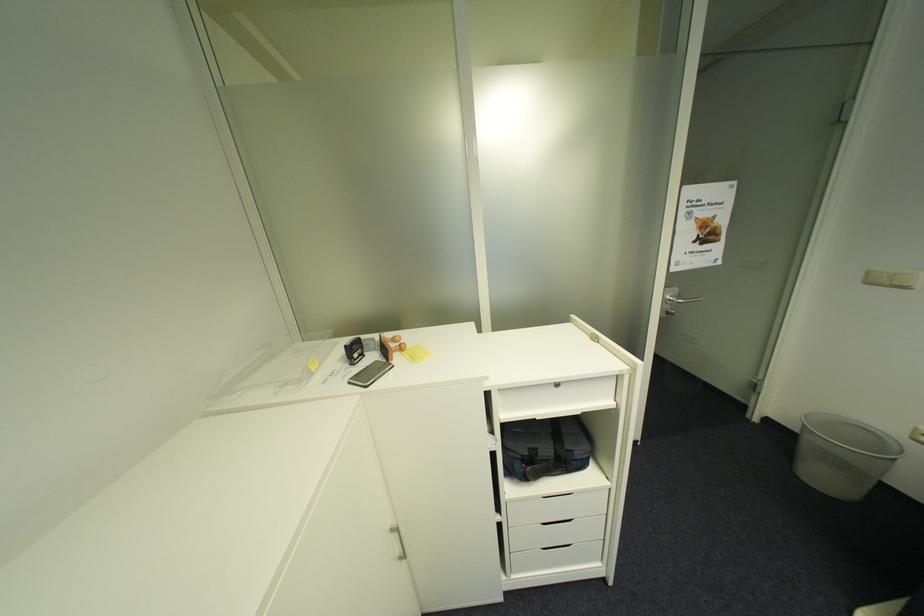
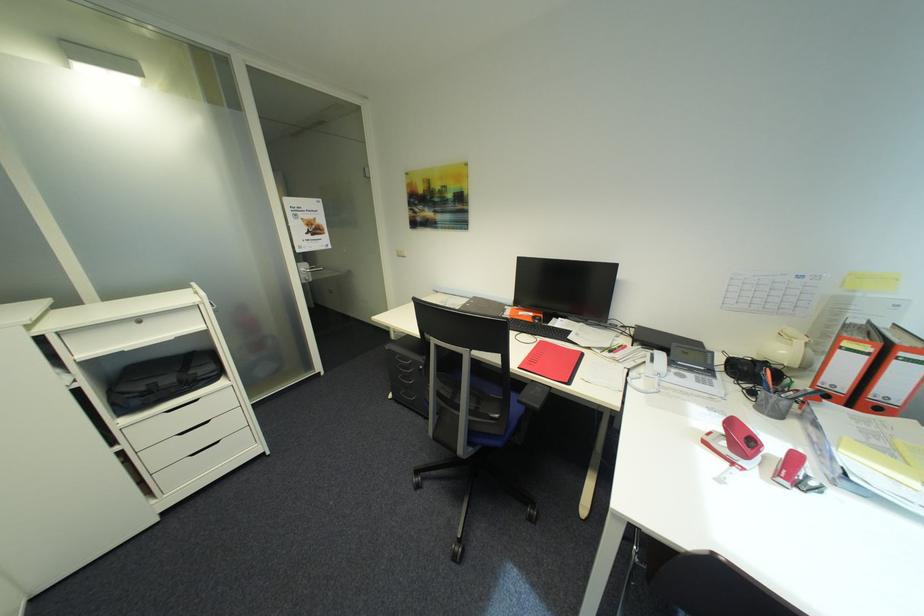
In the second image, find the point that corresponds to point (535, 454) in the first image.

(152, 389)